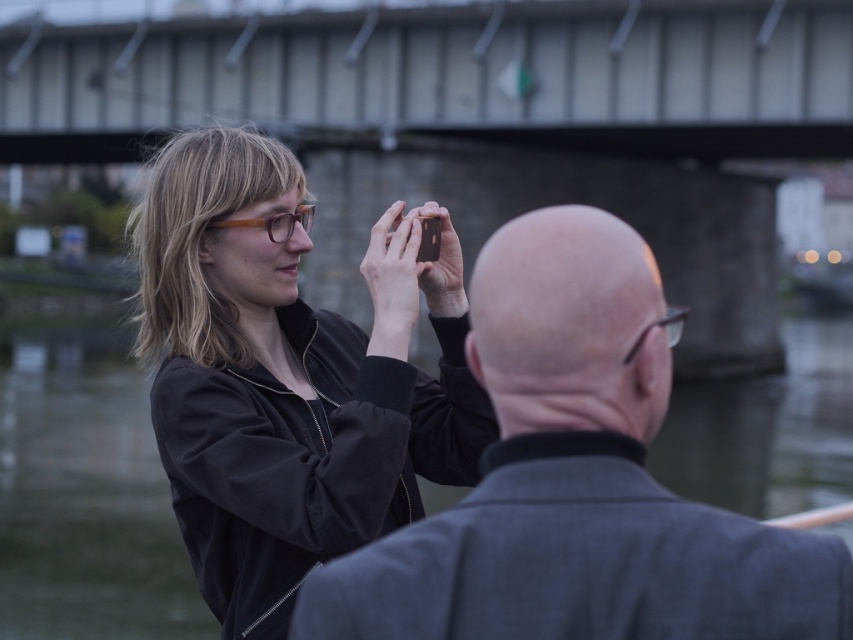
Question: Which of these objects is positioned closest to the brown translucent glasses at upper center?

Choices:
 (A) concrete bridge at upper center
 (B) matte black jacket at center
 (C) transparent plastic glasses at upper center

Answer: (B)

Question: From the image, what is the correct spatial relationship of dark gray wool coat at center in relation to brown translucent glasses at upper center?

Choices:
 (A) above
 (B) below

Answer: (B)

Question: Does concrete bridge at upper center appear under transparent plastic glasses at upper center?

Choices:
 (A) yes
 (B) no

Answer: (B)

Question: Does concrete bridge at upper center have a lesser width compared to matte black jacket at center?

Choices:
 (A) yes
 (B) no

Answer: (B)

Question: Which of the following is the farthest from the observer?

Choices:
 (A) click(x=286, y=212)
 (B) click(x=749, y=28)

Answer: (B)

Question: Which object is positioned farthest from the concrete bridge at upper center?

Choices:
 (A) matte black jacket at center
 (B) transparent plastic glasses at upper center
 (C) dark gray wool coat at center

Answer: (C)